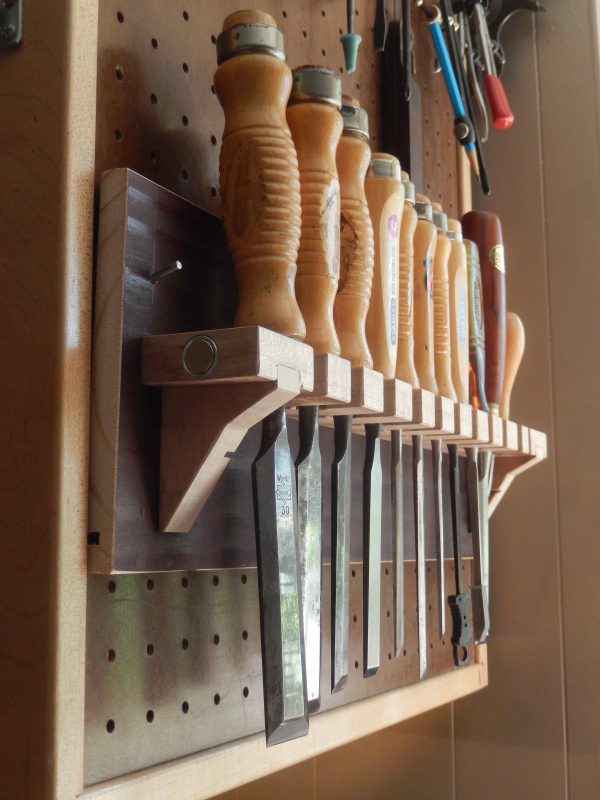
Where is `peg board`? peg board is located at coordinates (156, 68).